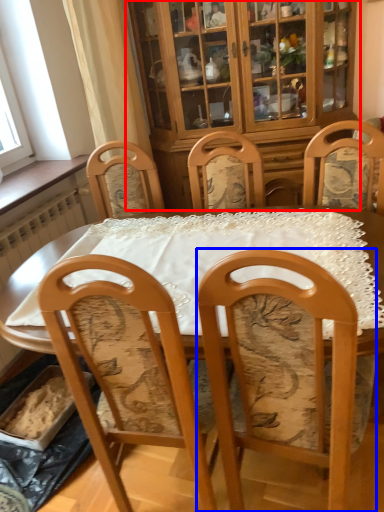
Question: Which object appears farthest to the camera in this image, cabinetry (highlighted by a red box) or chair (highlighted by a blue box)?

Choices:
 (A) cabinetry
 (B) chair

Answer: (A)